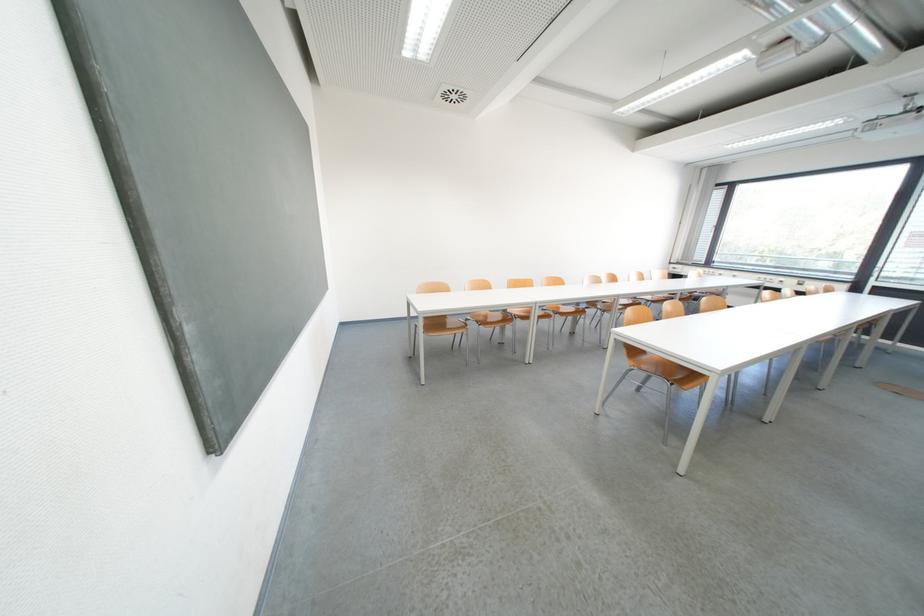
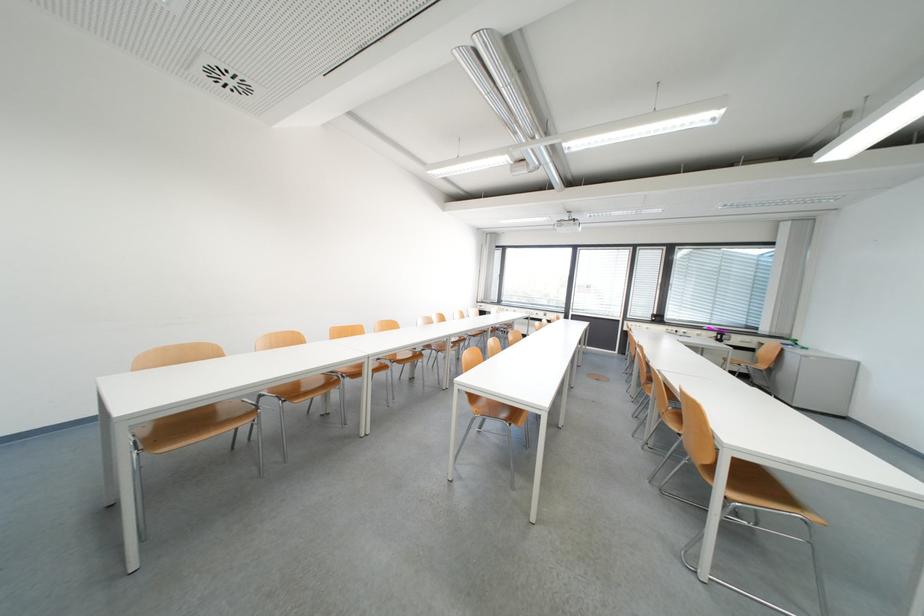
Question: The first image is from the beginning of the video and the second image is from the end. How did the camera likely rotate when shooting the video?

Choices:
 (A) Left
 (B) Right
 (C) Up
 (D) Down

Answer: (B)